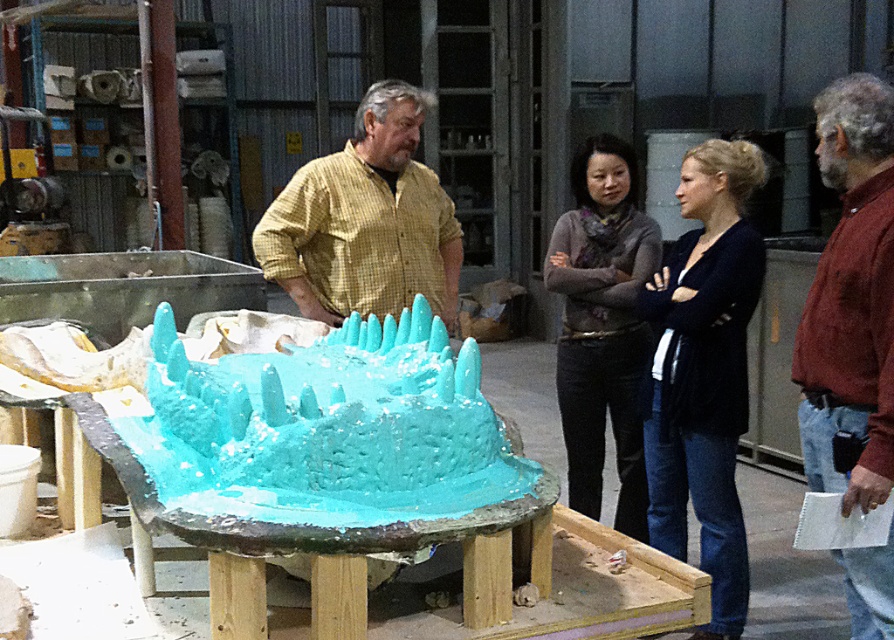
Looking at this image, you are an artist standing at the entrance of the workshop. You need to place a new tool on the floor near the turquoise clay sculpture at center. Based on the coordinates provided, where should you position the tool relative to the sculpture?

The turquoise clay sculpture at center is located at point coordinates (327, 428). To place the tool near it, position it close to these coordinates on the floor.